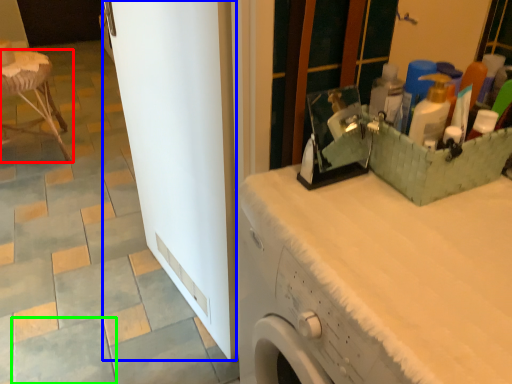
Question: Which object is the closest to the furniture (highlighted by a red box)? Choose among these: screen door (highlighted by a blue box) or ceramic tile (highlighted by a green box).

Choices:
 (A) screen door
 (B) ceramic tile

Answer: (A)